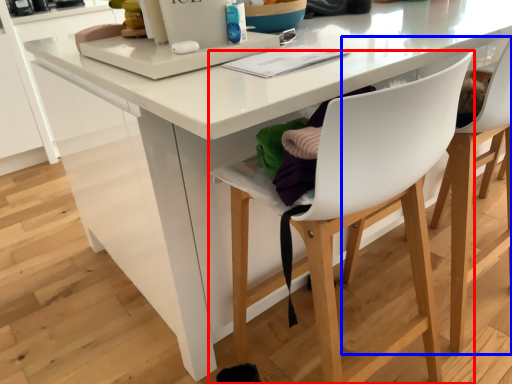
Question: Which point is closer to the camera, chair (highlighted by a red box) or chair (highlighted by a blue box)?

Choices:
 (A) chair
 (B) chair

Answer: (A)